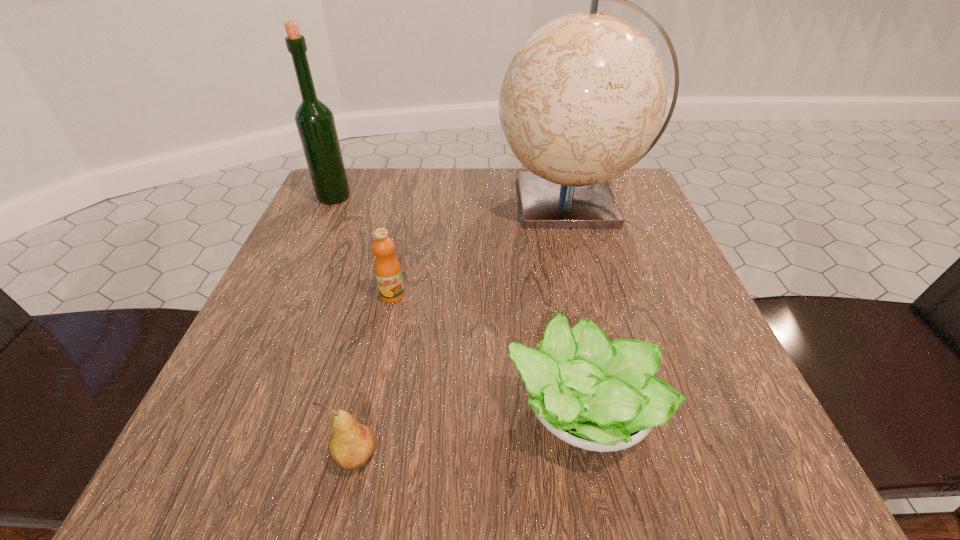
The width and height of the screenshot is (960, 540). I want to click on vacant area situated on the back of the pear, so (x=372, y=379).

At what (x,y) coordinates should I click in order to perform the action: click on free location located 0.100m on the left of the lettuce. Please return your answer as a coordinate pair (x, y). Looking at the image, I should click on (432, 410).

Locate an element on the screen. Image resolution: width=960 pixels, height=540 pixels. globe present at the far edge is located at coordinates (584, 96).

Find the location of `liquor that is positioned at the far edge`. liquor that is positioned at the far edge is located at coordinates (315, 122).

Locate an element on the screen. This screenshot has height=540, width=960. pear located in the near edge section of the desktop is located at coordinates (351, 446).

This screenshot has width=960, height=540. I want to click on lettuce situated at the near edge, so click(x=600, y=396).

The width and height of the screenshot is (960, 540). Identify the location of object that is positioned at the left edge. (315, 122).

Where is `globe present at the right edge`? globe present at the right edge is located at coordinates (584, 96).

This screenshot has width=960, height=540. What are the coordinates of `lettuce that is at the right edge` in the screenshot? It's located at (600, 396).

The height and width of the screenshot is (540, 960). I want to click on object positioned at the far left corner, so click(x=315, y=122).